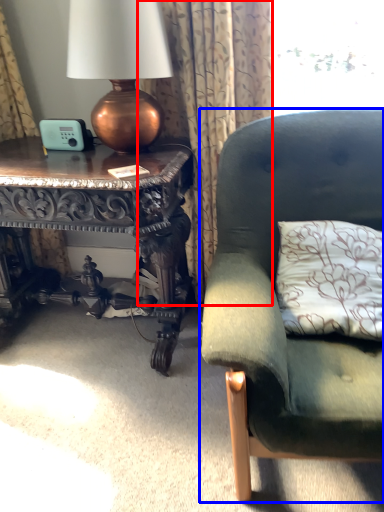
Question: Which object appears closest to the camera in this image, curtain (highlighted by a red box) or studio couch (highlighted by a blue box)?

Choices:
 (A) curtain
 (B) studio couch

Answer: (B)